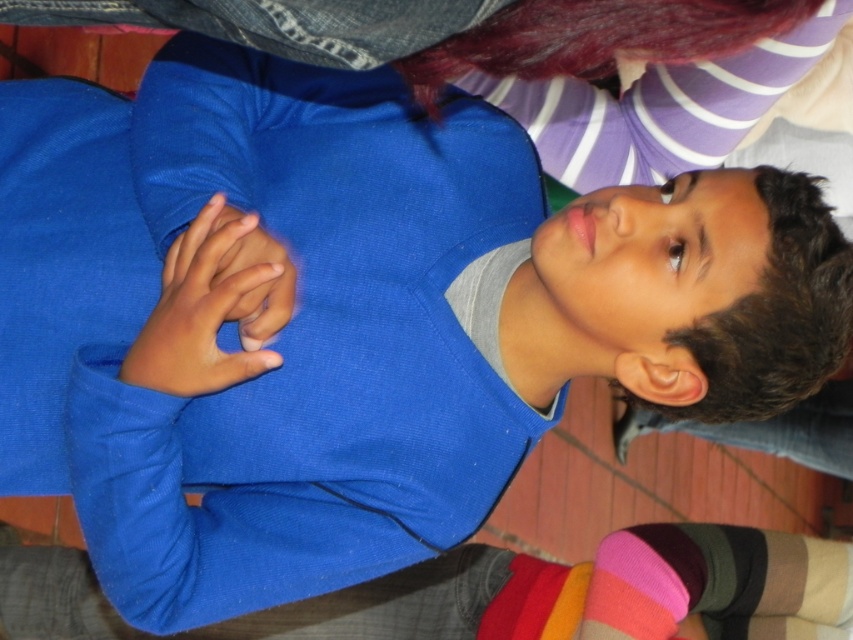
You are a photographer setting up a shoot in this scene. You need to place a small prop between the smooth blue hand at center and the pink knitted sock at lower right. Based on their positions, which object should the prop be closer to?

The smooth blue hand at center is positioned on the left side of the pink knitted sock at lower right, so the prop should be placed closer to the pink knitted sock at lower right since it is to the right of the hand.

You are a photographer setting up a shot in the scene. You need to ensure that the smooth blue hand at center is positioned higher than the pink knitted sock at lower right in the final image. Based on the current arrangement, will this be possible?

The smooth blue hand at center is not as tall as the pink knitted sock at lower right, so it cannot be positioned higher in the final image without adjusting their positions.